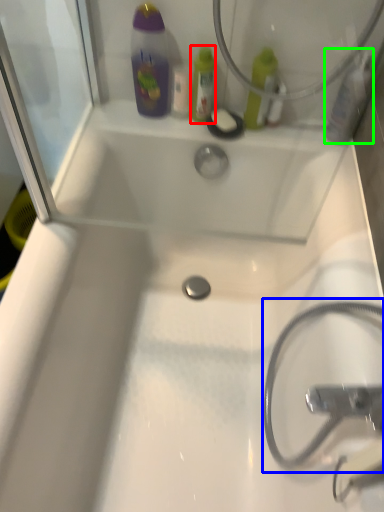
Question: Based on their relative distances, which object is farther from mouthwash (highlighted by a red box)? Choose from garden hose (highlighted by a blue box) and mouthwash (highlighted by a green box).

Choices:
 (A) garden hose
 (B) mouthwash

Answer: (A)